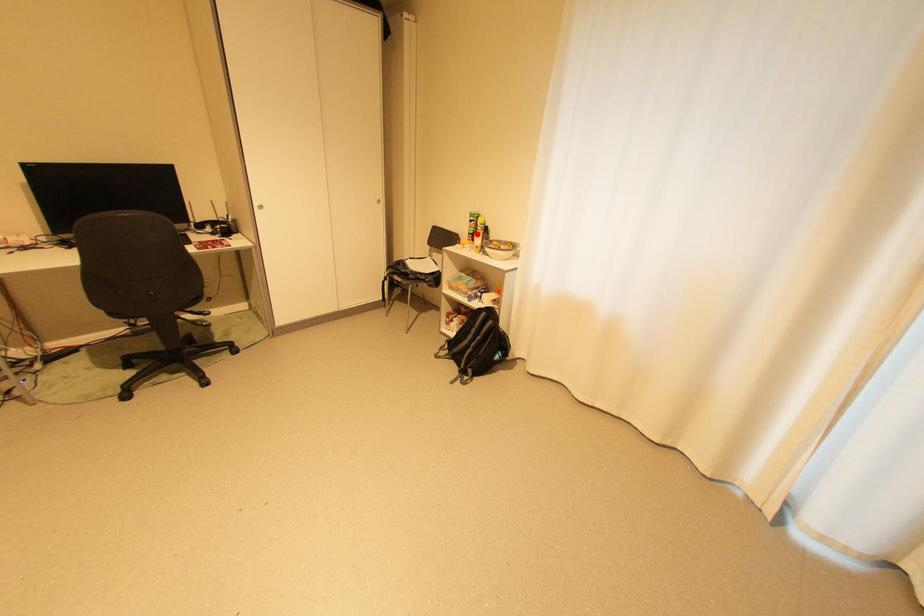
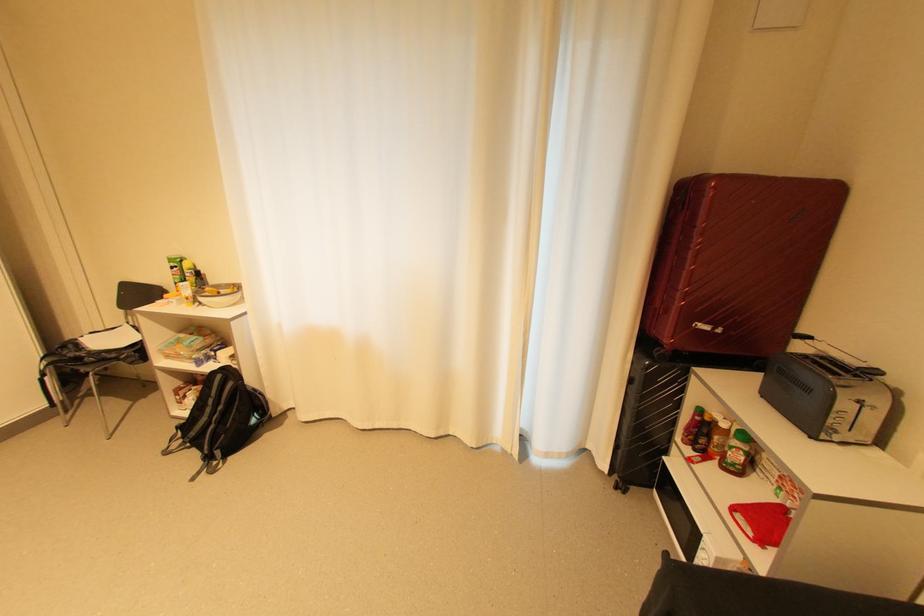
In the second image, find the point that corresponds to the highlighted location in the first image.

(185, 284)